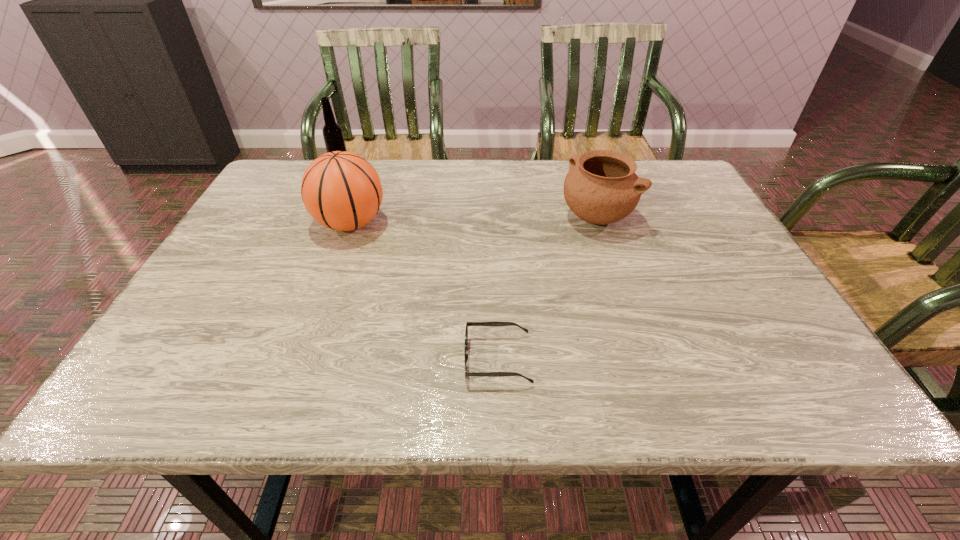
Locate an element on the screen. This screenshot has width=960, height=540. the farthest object is located at coordinates (333, 136).

Locate an element on the screen. The height and width of the screenshot is (540, 960). basketball is located at coordinates (342, 191).

This screenshot has height=540, width=960. Find the location of `the rightmost object`. the rightmost object is located at coordinates (601, 187).

This screenshot has width=960, height=540. I want to click on the second shortest object, so click(601, 187).

Find the location of `the shortest object`. the shortest object is located at coordinates (496, 324).

At what (x,y) coordinates should I click in order to perform the action: click on the third object from left to right. Please return your answer as a coordinate pair (x, y). Looking at the image, I should click on (496, 324).

The width and height of the screenshot is (960, 540). Identify the location of free space located 0.350m on the front of the beer bottle. (304, 246).

Where is `free space located on the front of the basketball`? The image size is (960, 540). free space located on the front of the basketball is located at coordinates (328, 284).

Find the location of a particular element. free point located on the left of the rightmost object is located at coordinates (405, 218).

The width and height of the screenshot is (960, 540). Find the location of `free point located 0.230m at the front lenses of the shortest object`. free point located 0.230m at the front lenses of the shortest object is located at coordinates (340, 359).